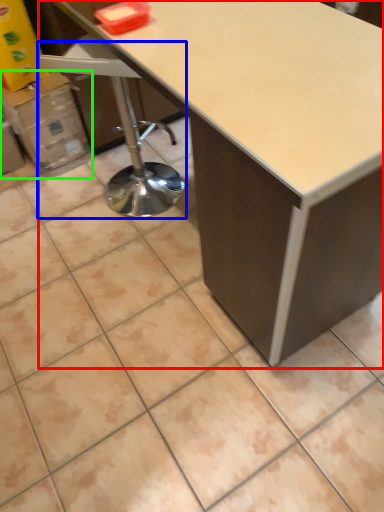
Question: Considering the real-world distances, which object is closest to table (highlighted by a red box)? swivel chair (highlighted by a blue box) or cardboard box (highlighted by a green box).

Choices:
 (A) swivel chair
 (B) cardboard box

Answer: (A)